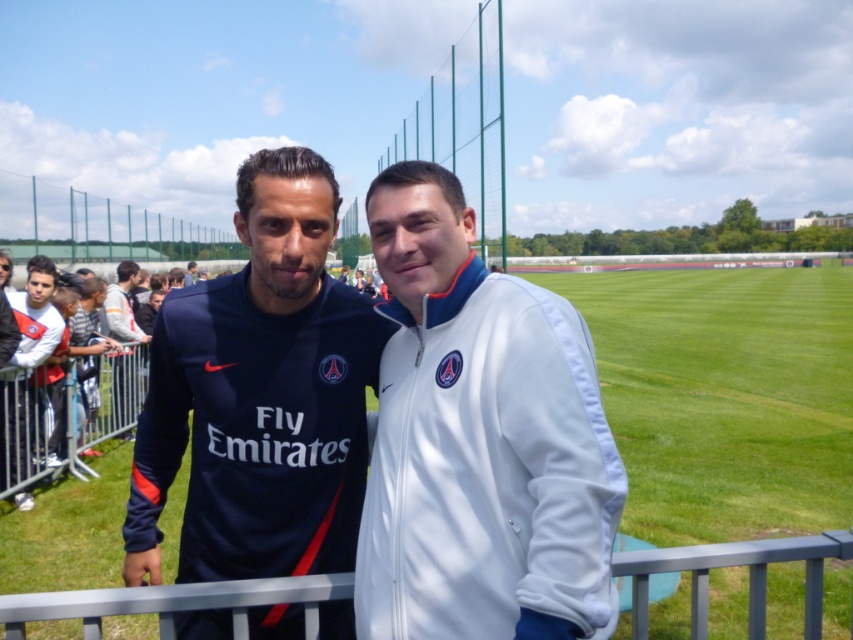
Question: Can you confirm if dark blue jersey at center is positioned to the left of white jersey at center?

Choices:
 (A) no
 (B) yes

Answer: (A)

Question: Where is metallic gray rail at lower center located in relation to white jersey at center in the image?

Choices:
 (A) right
 (B) left

Answer: (A)

Question: Based on their relative distances, which object is nearer to the white jersey at center?

Choices:
 (A) dark blue jersey at center
 (B) metallic gray rail at lower center

Answer: (A)

Question: Based on their relative distances, which object is farther from the white jersey at center?

Choices:
 (A) metallic gray rail at lower center
 (B) white fabric jacket at center

Answer: (A)

Question: Can you confirm if white fabric jacket at center is positioned to the left of metallic gray rail at lower center?

Choices:
 (A) yes
 (B) no

Answer: (A)

Question: Which object is closer to the camera taking this photo?

Choices:
 (A) dark blue jersey at center
 (B) metallic gray rail at lower center

Answer: (B)